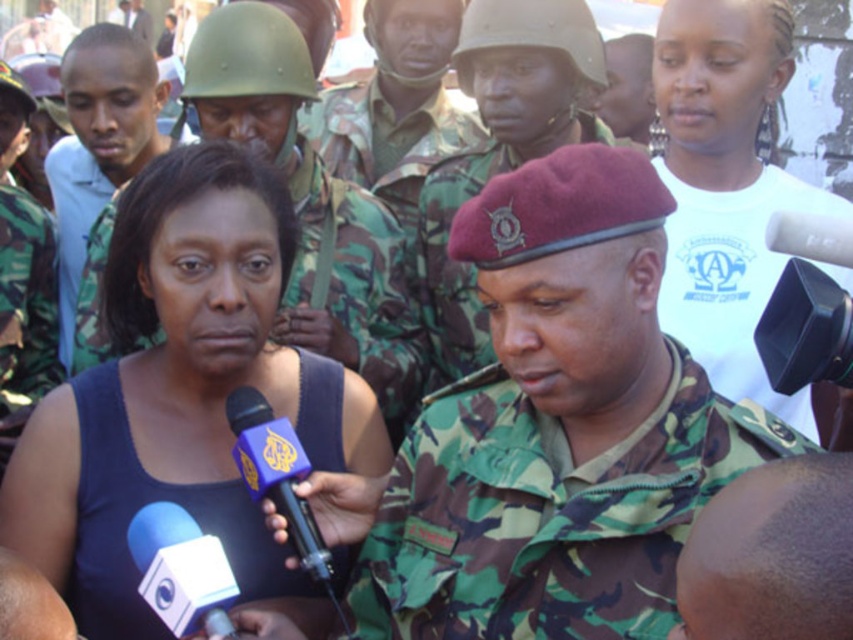
Question: Does dark skin bald head at center have a smaller size compared to blue matte microphone at lower left?

Choices:
 (A) no
 (B) yes

Answer: (A)

Question: Among these points, which one is farthest from the camera?

Choices:
 (A) (407, 504)
 (B) (741, 156)

Answer: (B)

Question: Which object appears closest to the camera in this image?

Choices:
 (A) blue fabric tank top at center
 (B) dark skin bald head at center

Answer: (B)

Question: From the image, what is the correct spatial relationship of dark blue fabric dress at center in relation to blue matte microphone at lower left?

Choices:
 (A) below
 (B) above

Answer: (A)

Question: Does dark blue fabric dress at center come in front of dark skin bald head at center?

Choices:
 (A) no
 (B) yes

Answer: (A)

Question: Which object is the farthest from the camouflage uniform at center?

Choices:
 (A) dark blue fabric dress at center
 (B) white cotton shirt at upper right

Answer: (B)